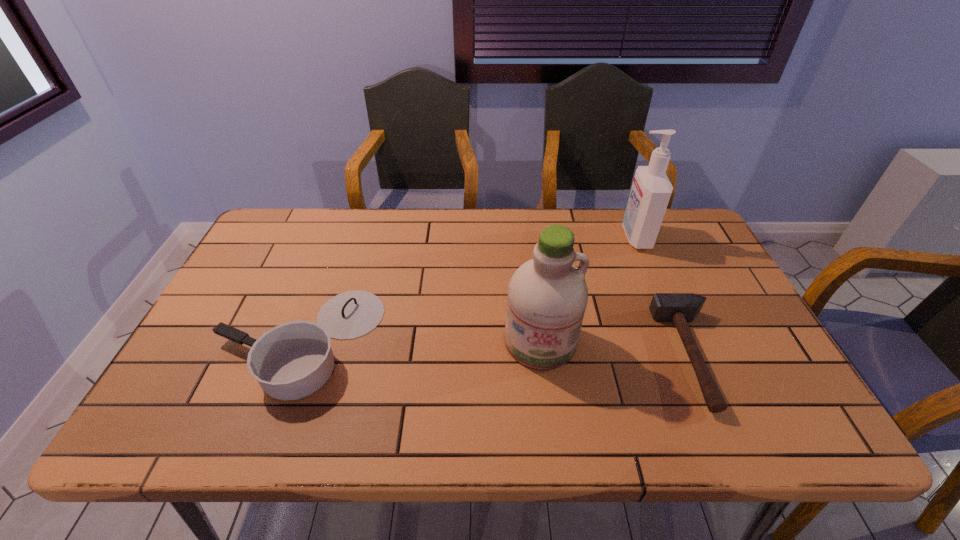
Locate an element on the screen. The height and width of the screenshot is (540, 960). free space at the far right corner of the desktop is located at coordinates (662, 228).

This screenshot has height=540, width=960. Identify the location of free space between the left cleansing agent and the leftmost object. (420, 341).

Locate an element on the screen. The image size is (960, 540). vacant space that's between the hammer and the third object from right to left is located at coordinates (616, 348).

The width and height of the screenshot is (960, 540). I want to click on vacant area that lies between the hammer and the second object from left to right, so [616, 348].

Find the location of a particular element. This screenshot has width=960, height=540. free spot between the hammer and the leftmost object is located at coordinates (496, 348).

What are the coordinates of `vacant point located between the right cleansing agent and the saucepan` in the screenshot? It's located at (468, 289).

At what (x,y) coordinates should I click in order to perform the action: click on object that is the second closest to the farther cleansing agent. Please return your answer as a coordinate pair (x, y). The width and height of the screenshot is (960, 540). Looking at the image, I should click on (547, 296).

In order to click on the second closest object to the right cleansing agent in this screenshot , I will do [x=547, y=296].

Where is `vacant area in the image that satisfies the following two spatial constraints: 1. on the front label of the farther cleansing agent; 2. on the front label of the third object from right to left`? vacant area in the image that satisfies the following two spatial constraints: 1. on the front label of the farther cleansing agent; 2. on the front label of the third object from right to left is located at coordinates (680, 341).

Find the location of a particular element. The image size is (960, 540). vacant space that satisfies the following two spatial constraints: 1. on the front label of the right cleansing agent; 2. on the front label of the second object from left to right is located at coordinates (680, 341).